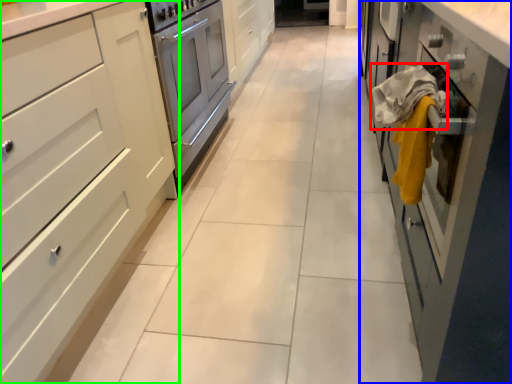
Question: Which is nearer to the blanket (highlighted by a red box)? cabinetry (highlighted by a blue box) or cabinetry (highlighted by a green box).

Choices:
 (A) cabinetry
 (B) cabinetry

Answer: (A)